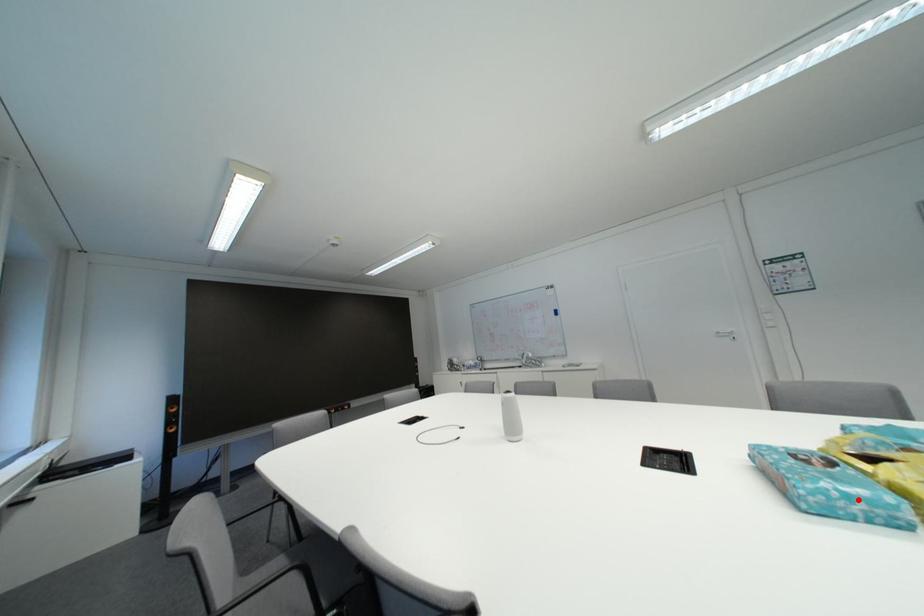
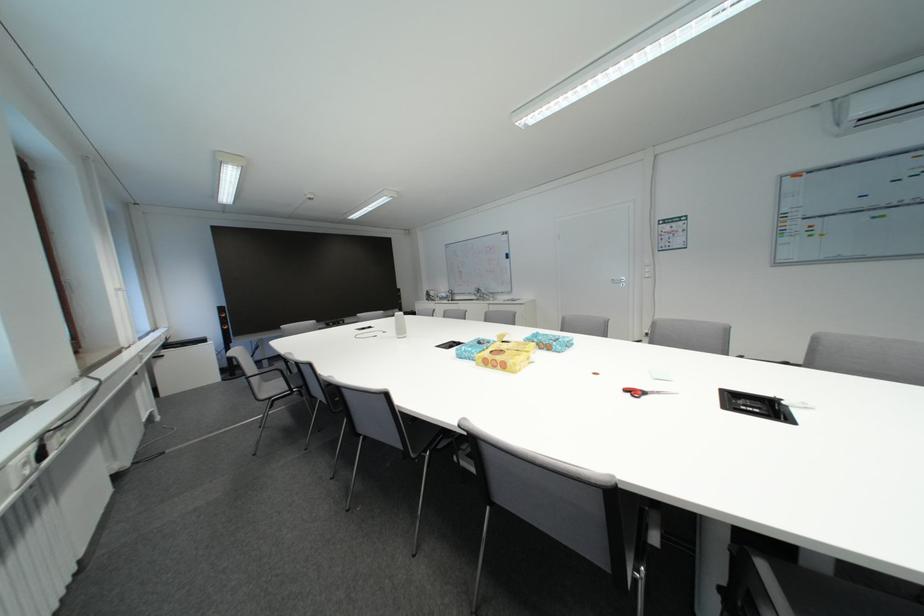
Where in the second image is the point corresponding to the highlighted location from the first image?

(476, 354)